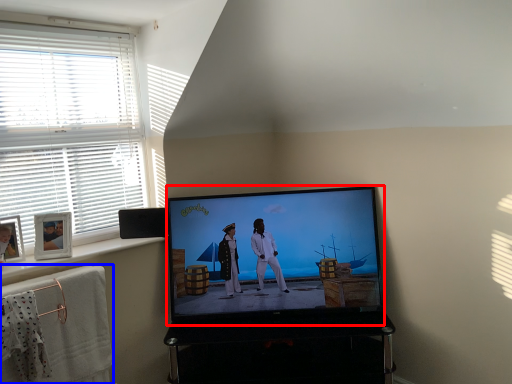
Question: Among these objects, which one is nearest to the camera, television (highlighted by a red box) or bath towel (highlighted by a blue box)?

Choices:
 (A) television
 (B) bath towel

Answer: (B)